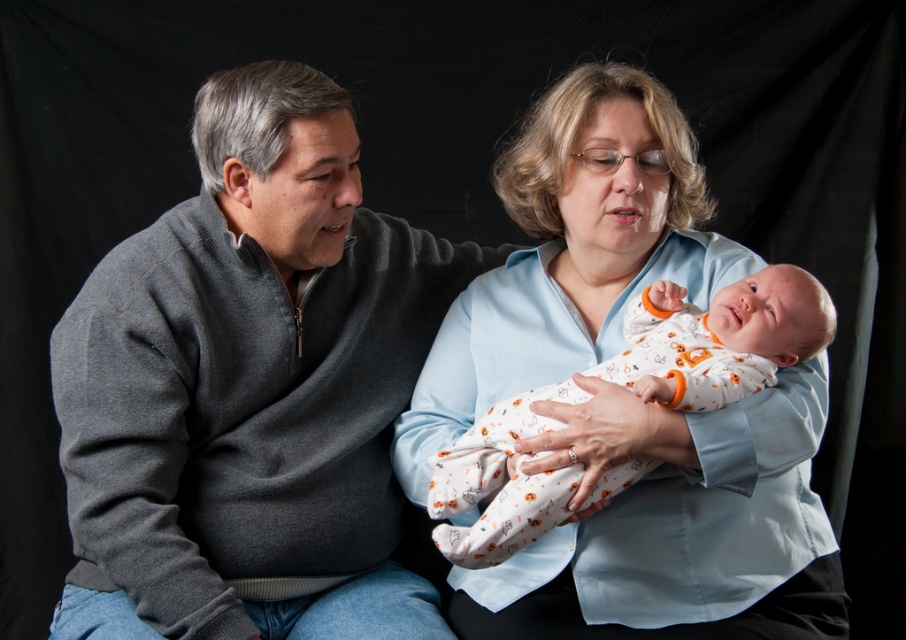
Question: Can you confirm if light blue shirt at center is bigger than white cotton onesie at center?

Choices:
 (A) no
 (B) yes

Answer: (B)

Question: Which object appears closest to the camera in this image?

Choices:
 (A) light blue shirt at center
 (B) gray sweater at left

Answer: (A)

Question: Which of the following is the farthest from the observer?

Choices:
 (A) white cotton onesie at center
 (B) gray sweater at left
 (C) light blue shirt at center

Answer: (B)

Question: Is light blue shirt at center below white cotton onesie at center?

Choices:
 (A) yes
 (B) no

Answer: (B)

Question: Estimate the real-world distances between objects in this image. Which object is closer to the gray sweater at left?

Choices:
 (A) white cotton onesie at center
 (B) light blue shirt at center

Answer: (B)

Question: Can you confirm if gray sweater at left is positioned to the right of white cotton onesie at center?

Choices:
 (A) no
 (B) yes

Answer: (A)